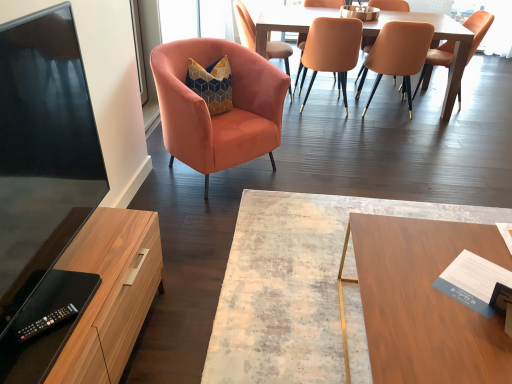
Question: Would you say velvet orange chair at upper left, the 2th chair in the left-to-right sequence, is part of matte orange chair at center, placed as the 3th chair when sorted from right to left,'s contents?

Choices:
 (A) no
 (B) yes

Answer: (A)

Question: Can you confirm if matte orange chair at center, arranged as the 4th chair when viewed from the left, is positioned to the left of velvet orange chair at upper left, which is counted as the 5th chair, starting from the right?

Choices:
 (A) yes
 (B) no

Answer: (B)

Question: From the image's perspective, does matte orange chair at center, placed as the 3th chair when sorted from right to left, appear higher than velvet orange chair at upper left, which is counted as the 5th chair, starting from the right?

Choices:
 (A) yes
 (B) no

Answer: (B)

Question: From a real-world perspective, is matte orange chair at center, arranged as the 4th chair when viewed from the left, physically above velvet orange chair at upper left, the 2th chair in the left-to-right sequence?

Choices:
 (A) yes
 (B) no

Answer: (A)

Question: Does matte orange chair at center, arranged as the 4th chair when viewed from the left, appear on the right side of velvet orange chair at upper left, which is counted as the 5th chair, starting from the right?

Choices:
 (A) no
 (B) yes

Answer: (B)

Question: Is the position of matte orange chair at center, placed as the 3th chair when sorted from right to left, more distant than that of velvet orange chair at upper left, which is counted as the 5th chair, starting from the right?

Choices:
 (A) no
 (B) yes

Answer: (A)

Question: Is the depth of matte orange chair at upper center, which is the 3th chair from left to right, greater than that of matte orange chair at center, arranged as the 4th chair when viewed from the left?

Choices:
 (A) yes
 (B) no

Answer: (A)

Question: Are matte orange chair at upper center, which is the 3th chair from left to right, and matte orange chair at center, arranged as the 4th chair when viewed from the left, far apart?

Choices:
 (A) yes
 (B) no

Answer: (B)

Question: Could you tell me if matte orange chair at upper center, which is the 3th chair from left to right, is turned towards matte orange chair at center, placed as the 3th chair when sorted from right to left?

Choices:
 (A) yes
 (B) no

Answer: (A)

Question: Can you confirm if matte orange chair at upper center, which is the 3th chair from left to right, is thinner than matte orange chair at center, arranged as the 4th chair when viewed from the left?

Choices:
 (A) no
 (B) yes

Answer: (B)

Question: Does matte orange chair at upper center, the 4th chair from the right, have a smaller size compared to matte orange chair at center, placed as the 3th chair when sorted from right to left?

Choices:
 (A) yes
 (B) no

Answer: (A)

Question: Does matte orange chair at upper center, which is the 3th chair from left to right, have a lesser height compared to matte orange chair at center, placed as the 3th chair when sorted from right to left?

Choices:
 (A) yes
 (B) no

Answer: (B)

Question: Are wooden cabinet at left and wooden rectangular table at center beside each other?

Choices:
 (A) yes
 (B) no

Answer: (B)